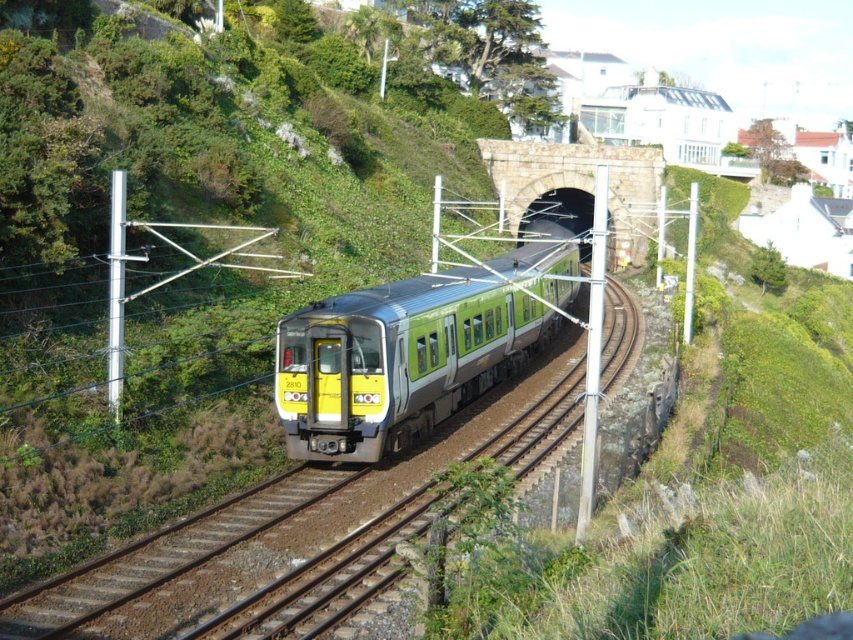
Question: Which object is farther from the camera taking this photo?

Choices:
 (A) brown gravel train track at center
 (B) green metallic train at center
 (C) metallic silver track at center

Answer: (B)

Question: Considering the relative positions of metallic silver track at center and brown gravel train track at center in the image provided, where is metallic silver track at center located with respect to brown gravel train track at center?

Choices:
 (A) below
 (B) above

Answer: (B)

Question: Can you confirm if green metallic train at center is positioned above metallic silver track at center?

Choices:
 (A) yes
 (B) no

Answer: (A)

Question: Which object appears farthest from the camera in this image?

Choices:
 (A) metallic silver track at center
 (B) brown gravel train track at center

Answer: (B)

Question: Can you confirm if green metallic train at center is thinner than brown gravel train track at center?

Choices:
 (A) no
 (B) yes

Answer: (A)

Question: Which object is closer to the camera taking this photo?

Choices:
 (A) green metallic train at center
 (B) brown gravel train track at center

Answer: (B)